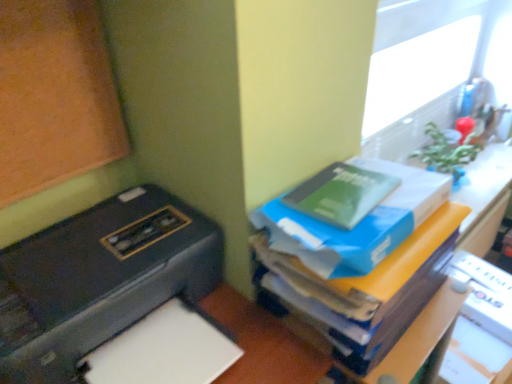
Question: Would you say black plastic printer at left is inside or outside blue cardboard box at upper right?

Choices:
 (A) inside
 (B) outside

Answer: (B)

Question: Does point (211, 329) appear closer or farther from the camera than point (321, 340)?

Choices:
 (A) closer
 (B) farther

Answer: (A)

Question: Estimate the real-world distances between objects in this image. Which object is farther from the blue cardboard box at upper right?

Choices:
 (A) white paper at lower left
 (B) green matte book at upper right, placed as the 1th paperback book when sorted from top to bottom
 (C) wooden bulletin board at left
 (D) green matte book at upper right, the second paperback book positioned from the top
 (E) black plastic printer at left

Answer: (C)

Question: Based on their relative distances, which object is nearer to the wooden bulletin board at left?

Choices:
 (A) black plastic printer at left
 (B) white paper at lower left
 (C) blue cardboard box at upper right
 (D) green matte book at upper right, the first paperback book ordered from the bottom
 (E) green matte book at upper right, placed as the 1th paperback book when sorted from top to bottom

Answer: (A)